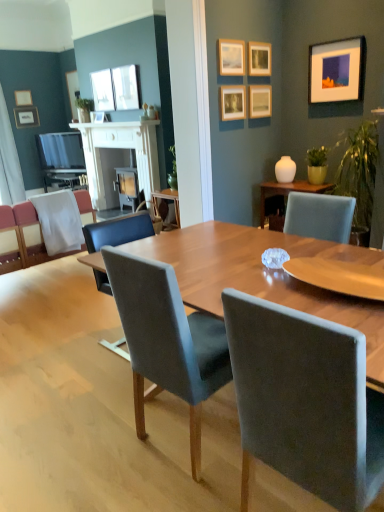
Question: In terms of size, does translucent glass coffee table at center appear bigger or smaller than white glossy vase at upper right?

Choices:
 (A) small
 (B) big

Answer: (B)

Question: From a real-world perspective, is translucent glass coffee table at center physically located above or below white glossy vase at upper right?

Choices:
 (A) above
 (B) below

Answer: (B)

Question: Considering the real-world distances, which object is closest to the matte wooden picture frame at upper center, which appears as the seventh picture frame when viewed from the back?

Choices:
 (A) green matte plant at right, the first houseplant positioned from the right
 (B) matte wooden picture frame at upper center, acting as the seventh picture frame starting from the left
 (C) matte white picture frame at upper left, the eighth picture frame from the right
 (D) matte glass picture frame at upper center, acting as the 6th picture frame starting from the front
 (E) clear glass window screen at upper center

Answer: (B)

Question: Which object is the farthest from the matte wooden picture frame at upper center, acting as the eighth picture frame starting from the left?

Choices:
 (A) matte silver picture frame at upper left, the first picture frame in the back-to-front sequence
 (B) white fabric chair at left, which is the 1th chair in left-to-right order
 (C) matte gold picture frame at upper left, placed as the 8th picture frame when sorted from front to back
 (D) translucent glass coffee table at center
 (E) white wood fireplace at upper center

Answer: (C)